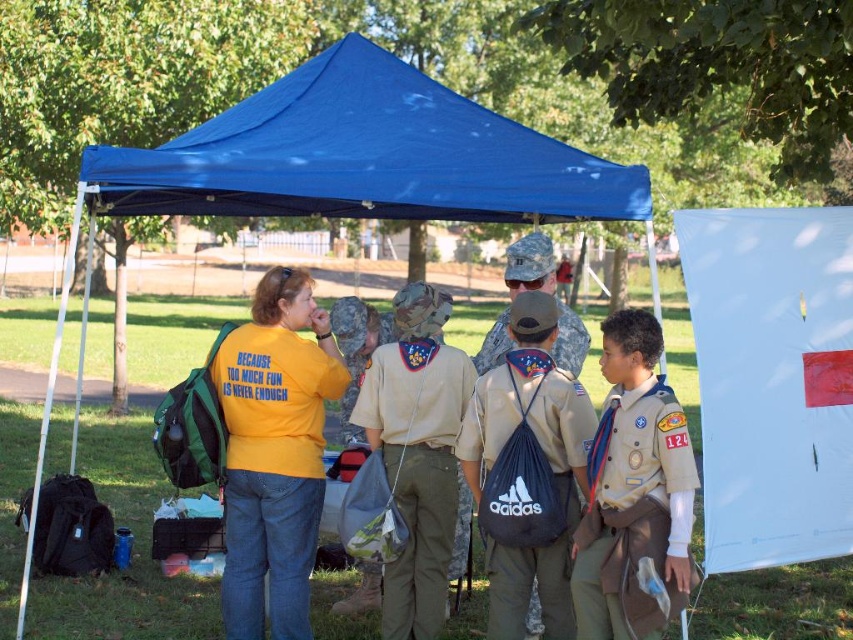
Which is behind, point (265, 120) or point (576, 563)?

The point (265, 120) is more distant.

Between blue fabric canopy at upper center and brown canvas uniform at center, which one appears on the right side from the viewer's perspective?

From the viewer's perspective, brown canvas uniform at center appears more on the right side.

Which is behind, point (334, 208) or point (590, 492)?

Positioned behind is point (334, 208).

Find the location of `blue fabric canopy at upper center`. blue fabric canopy at upper center is located at coordinates (364, 156).

Is blue fabric canopy at upper center thinner than yellow cotton shirt at center?

Incorrect, blue fabric canopy at upper center's width is not less than yellow cotton shirt at center's.

Can you confirm if blue fabric canopy at upper center is positioned above yellow cotton shirt at center?

Indeed, blue fabric canopy at upper center is positioned over yellow cotton shirt at center.

Image resolution: width=853 pixels, height=640 pixels. Identify the location of blue fabric canopy at upper center. (364, 156).

The width and height of the screenshot is (853, 640). Find the location of `blue fabric canopy at upper center`. blue fabric canopy at upper center is located at coordinates (364, 156).

Who is taller, yellow cotton shirt at center or dark blue synthetic backpack at center?

yellow cotton shirt at center

Is point (281, 362) positioned after point (573, 404)?

Yes, point (281, 362) is farther from viewer.

Which is behind, point (270, 452) or point (503, 577)?

The point (270, 452) is behind.

Identify the location of yellow cotton shirt at center. (273, 467).